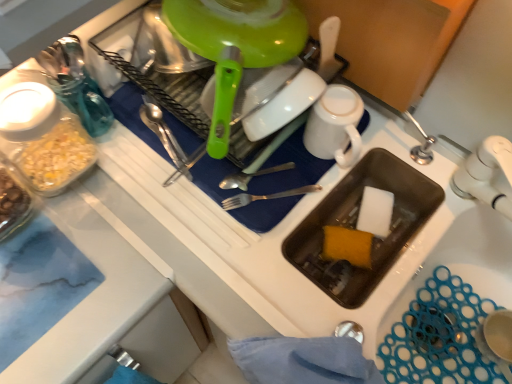
This screenshot has height=384, width=512. In order to click on vacant area that is in front of white matte mug at upper center in this screenshot , I will do `click(297, 232)`.